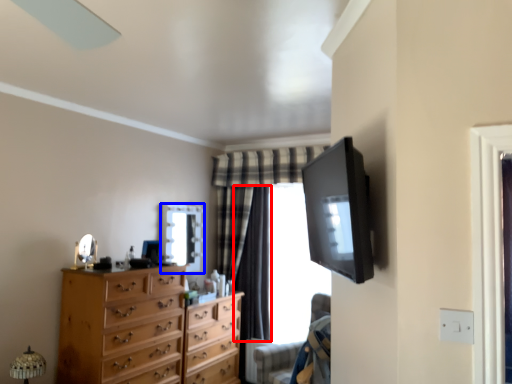
Question: Which point is further to the camera, curtain (highlighted by a red box) or mirror (highlighted by a blue box)?

Choices:
 (A) curtain
 (B) mirror

Answer: (A)